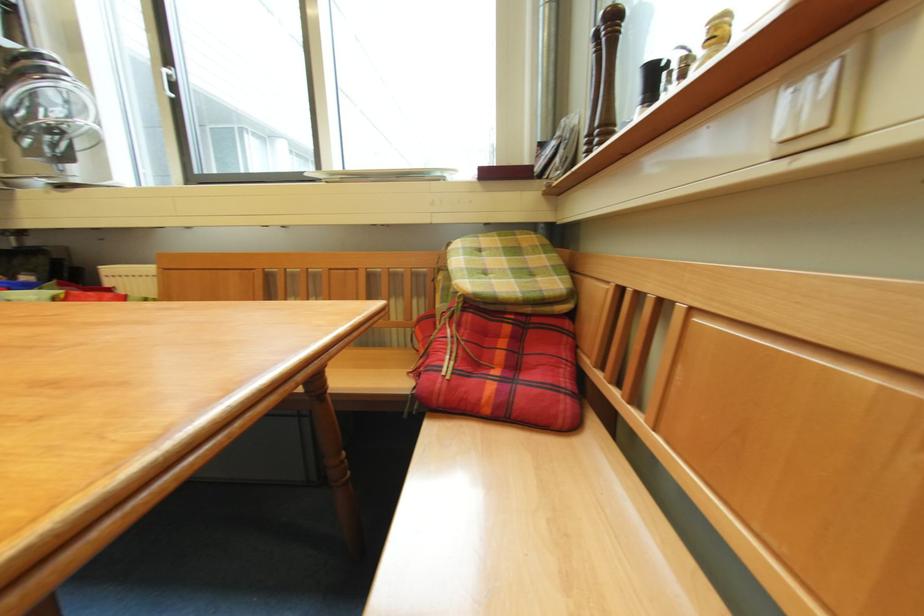
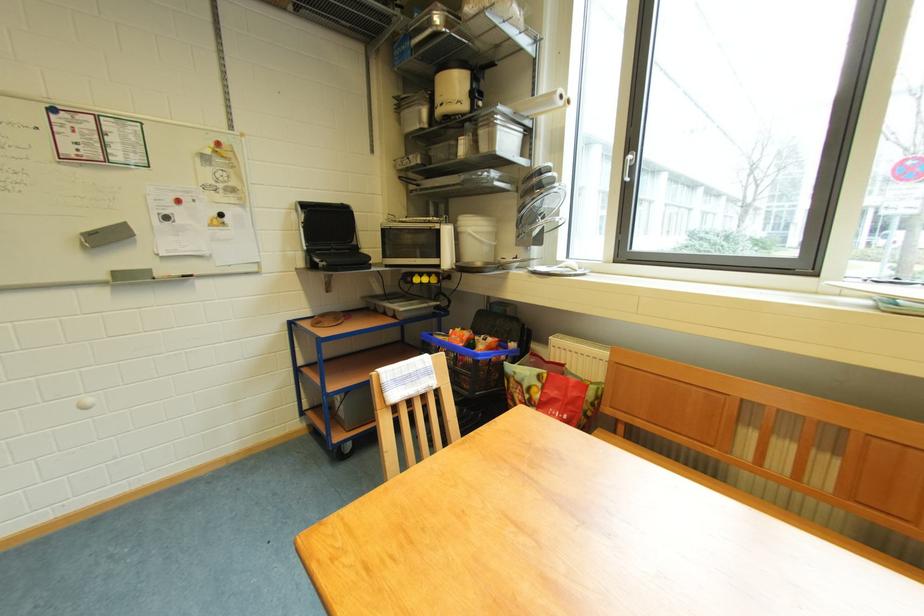
Question: The camera is either moving clockwise (left) or counter-clockwise (right) around the object. The first image is from the beginning of the video and the second image is from the end. Is the camera moving left or right when shooting the video?

Choices:
 (A) Left
 (B) Right

Answer: (B)